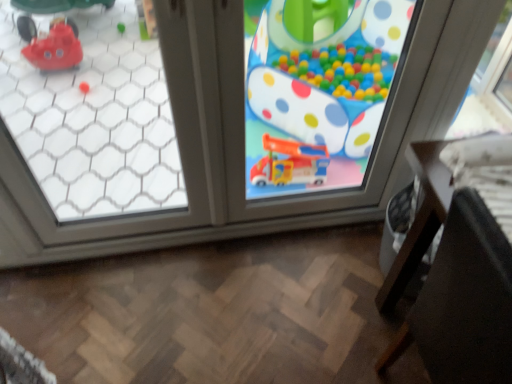
Question: Is matte plastic toy at center taller than black leather chair at lower right?

Choices:
 (A) yes
 (B) no

Answer: (A)

Question: Does matte plastic toy at center have a larger size compared to black leather chair at lower right?

Choices:
 (A) no
 (B) yes

Answer: (A)

Question: From the image's perspective, would you say matte plastic toy at center is positioned over black leather chair at lower right?

Choices:
 (A) yes
 (B) no

Answer: (A)

Question: Does matte plastic toy at center appear on the right side of black leather chair at lower right?

Choices:
 (A) yes
 (B) no

Answer: (B)

Question: Would you say matte plastic toy at center is outside black leather chair at lower right?

Choices:
 (A) yes
 (B) no

Answer: (A)

Question: Is transparent glass window at upper left, placed as the 2th window when sorted from right to left, wider or thinner than matte plastic toy at center?

Choices:
 (A) thin
 (B) wide

Answer: (A)

Question: Is transparent glass window at upper left, which is the first window from left to right, inside or outside of matte plastic toy at center?

Choices:
 (A) inside
 (B) outside

Answer: (B)

Question: In terms of size, does transparent glass window at upper left, placed as the 2th window when sorted from right to left, appear bigger or smaller than matte plastic toy at center?

Choices:
 (A) big
 (B) small

Answer: (B)

Question: Is transparent glass window at upper left, placed as the 2th window when sorted from right to left, taller or shorter than matte plastic toy at center?

Choices:
 (A) tall
 (B) short

Answer: (A)

Question: Is black leather chair at lower right wider or thinner than transparent glass window at upper left, placed as the 2th window when sorted from right to left?

Choices:
 (A) thin
 (B) wide

Answer: (B)

Question: From a real-world perspective, is black leather chair at lower right positioned above or below transparent glass window at upper left, placed as the 2th window when sorted from right to left?

Choices:
 (A) below
 (B) above

Answer: (A)

Question: From their relative heights in the image, would you say black leather chair at lower right is taller or shorter than transparent glass window at upper left, which is the first window from left to right?

Choices:
 (A) short
 (B) tall

Answer: (A)

Question: Visually, is black leather chair at lower right positioned to the left or to the right of transparent glass window at upper left, placed as the 2th window when sorted from right to left?

Choices:
 (A) left
 (B) right

Answer: (B)

Question: From the image's perspective, relative to transparent glass window at center, the 1th window when ordered from right to left, is black leather chair at lower right above or below?

Choices:
 (A) above
 (B) below

Answer: (B)

Question: Considering the positions of black leather chair at lower right and transparent glass window at center, the 1th window when ordered from right to left, in the image, is black leather chair at lower right bigger or smaller than transparent glass window at center, the 1th window when ordered from right to left,?

Choices:
 (A) big
 (B) small

Answer: (A)